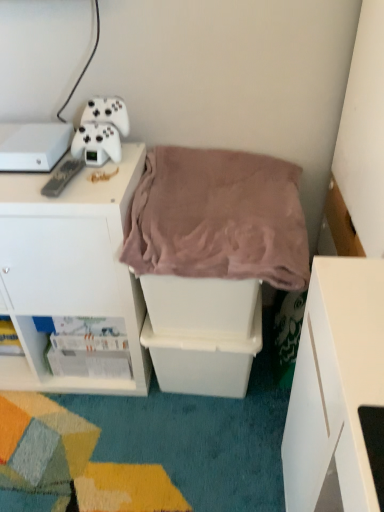
Identify the location of vacant space in front of white plastic storage bin at center, the first shelf in the right-to-left sequence. (199, 449).